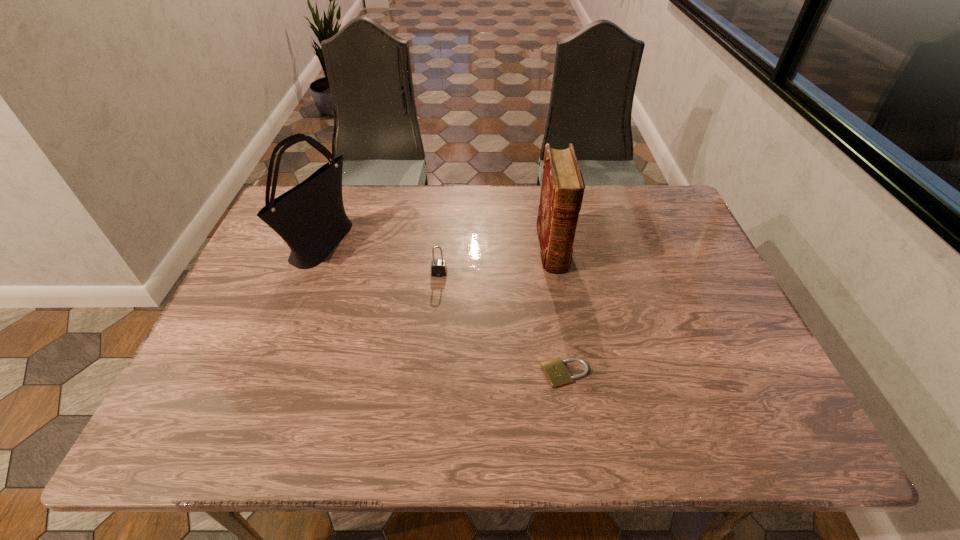
Locate an element on the screen. the tallest object is located at coordinates (310, 217).

I want to click on the leftmost object, so click(310, 217).

This screenshot has height=540, width=960. Find the location of `hardback book`. hardback book is located at coordinates (562, 189).

The image size is (960, 540). I want to click on the third object from right to left, so click(438, 267).

Where is `the farther padlock`? the farther padlock is located at coordinates (438, 267).

You are a GUI agent. You are given a task and a screenshot of the screen. Output one action in this format:
    pyautogui.click(x=<x>, y=<y>)
    Task: Click on the shortest object
    The width and height of the screenshot is (960, 540).
    Given the screenshot: What is the action you would take?
    pyautogui.click(x=555, y=371)

I want to click on the shorter padlock, so pyautogui.click(x=555, y=371).

Where is `vacant region located 0.100m on the front of the shoulder bag`? vacant region located 0.100m on the front of the shoulder bag is located at coordinates (297, 307).

Find the location of `vacant space located 0.340m on the spine side of the second tallest object`. vacant space located 0.340m on the spine side of the second tallest object is located at coordinates (577, 387).

Where is `vacant space located 0.090m on the shackle of the third tallest object`? The image size is (960, 540). vacant space located 0.090m on the shackle of the third tallest object is located at coordinates (437, 302).